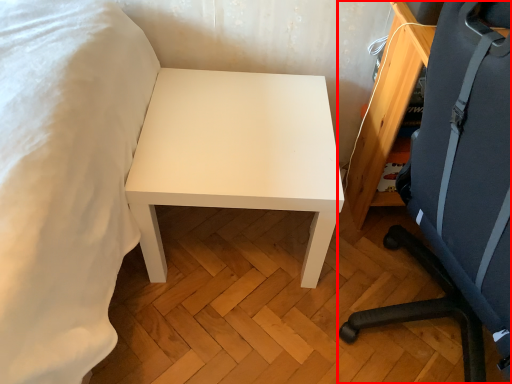
Question: Where is chair (annotated by the red box) located in relation to table in the image?

Choices:
 (A) left
 (B) right

Answer: (B)